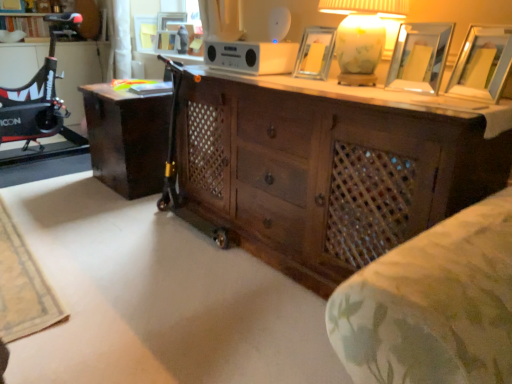
Locate an element on the screen. This screenshot has height=384, width=512. vacant space in front of metallic silver picture frame at upper center, which ranks as the 3th picture frame in top-to-bottom order is located at coordinates 319,82.